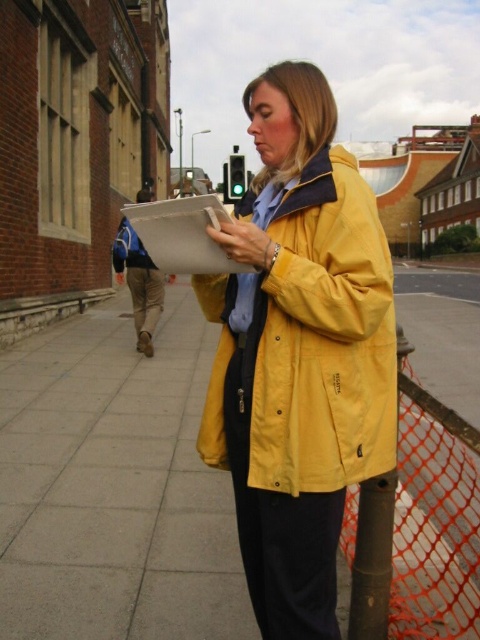
You are a fashion designer observing the urban street scene. You notice two jackets of the same color but different textures at the center. How far apart are the yellow fabric jacket at center and the yellow matte jacket at center?

The yellow fabric jacket at center is 2.89 meters from the yellow matte jacket at center.

You are a fashion designer observing an urban street scene. You notice two jackets displayed on mannequins at the center of the image. The jackets are labeled as yellow fabric jacket at center and yellow matte jacket at center. Based on their appearance in the scene, which jacket appears to be larger in size?

The yellow fabric jacket at center appears larger in size because it is much taller than the yellow matte jacket at center.